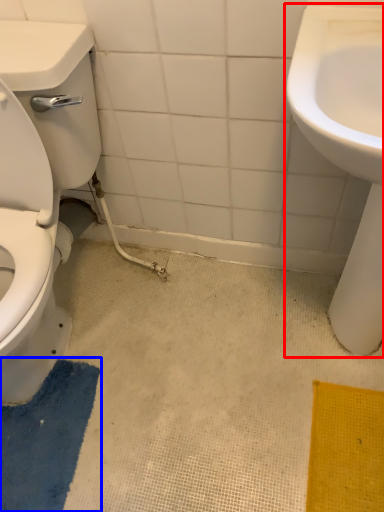
Question: Which of the following is the closest to the observer, sink (highlighted by a red box) or bath mat (highlighted by a blue box)?

Choices:
 (A) sink
 (B) bath mat

Answer: (A)